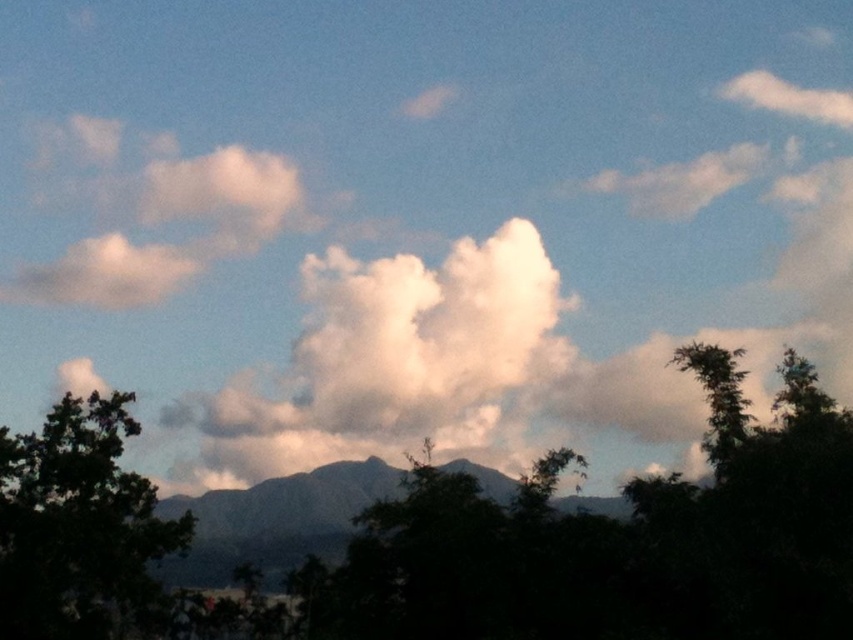
Can you confirm if dark green leafy tree at lower left is smaller than green leafy tree at right?

Incorrect, dark green leafy tree at lower left is not smaller in size than green leafy tree at right.

Which is in front, point (38, 540) or point (694, 342)?

Point (38, 540) is more forward.

Locate an element on the screen. The height and width of the screenshot is (640, 853). dark green leafy tree at lower left is located at coordinates pyautogui.click(x=80, y=529).

Is gray matte mountain at center to the right of green leafy tree at right from the viewer's perspective?

In fact, gray matte mountain at center is to the left of green leafy tree at right.

Find the location of a particular element. gray matte mountain at center is located at coordinates (276, 522).

Between dark green leafy tree at lower left and gray matte mountain at center, which one is positioned lower?

gray matte mountain at center is below.

Is dark green leafy tree at lower left smaller than gray matte mountain at center?

Indeed, dark green leafy tree at lower left has a smaller size compared to gray matte mountain at center.

Who is more forward, (x=47, y=460) or (x=502, y=476)?

Point (x=47, y=460)

Find the location of a particular element. dark green leafy tree at lower left is located at coordinates (80, 529).